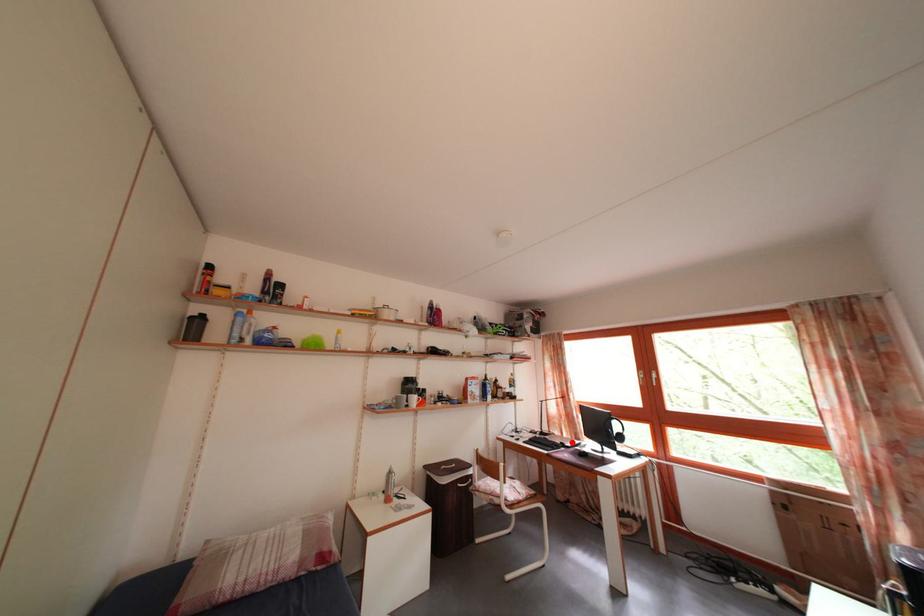
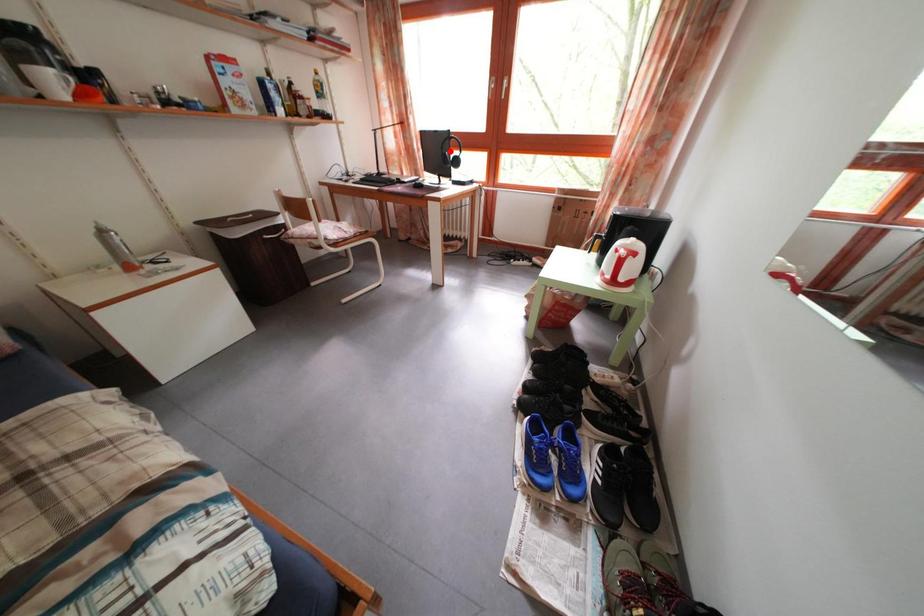
I am providing you with two images of the same scene from different viewpoints. A red point is marked on the first image and another point is marked on the second image. Do the highlighted points in image1 and image2 indicate the same real-world spot?

No